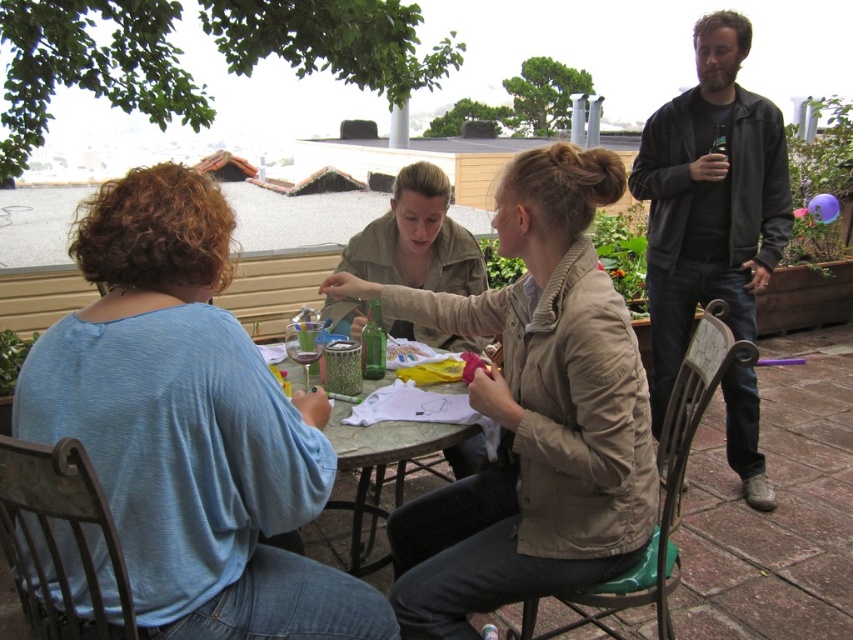
Which is behind, point (184, 372) or point (379, 432)?

The point (379, 432) is behind.

Who is shorter, light blue jersey at left or marble-patterned table at center?

Standing shorter between the two is marble-patterned table at center.

This screenshot has height=640, width=853. In order to click on light blue jersey at left in this screenshot , I will do `click(189, 426)`.

Does matte beige jacket at center appear on the right side of marble-patterned table at center?

Correct, you'll find matte beige jacket at center to the right of marble-patterned table at center.

What do you see at coordinates (532, 413) in the screenshot?
I see `matte beige jacket at center` at bounding box center [532, 413].

Who is more distant from viewer, [454,531] or [360,516]?

The point [360,516] is more distant.

Image resolution: width=853 pixels, height=640 pixels. Find the location of `matte beige jacket at center`. matte beige jacket at center is located at coordinates (532, 413).

Based on the photo, does matte beige jacket at center have a greater height compared to khaki cotton jacket at center?

Correct, matte beige jacket at center is much taller as khaki cotton jacket at center.

Which is below, matte beige jacket at center or khaki cotton jacket at center?

Positioned lower is matte beige jacket at center.

Where is `matte beige jacket at center`? The width and height of the screenshot is (853, 640). matte beige jacket at center is located at coordinates (532, 413).